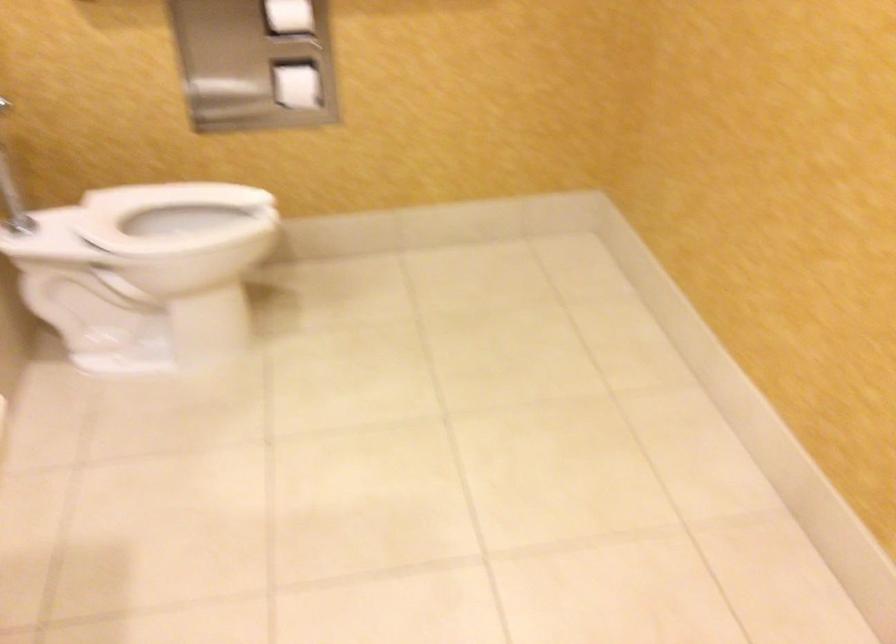
At what (x,y) coordinates should I click in order to perform the action: click on white toilet seat. Please return your answer as a coordinate pair (x, y). The height and width of the screenshot is (644, 896). Looking at the image, I should click on (174, 216).